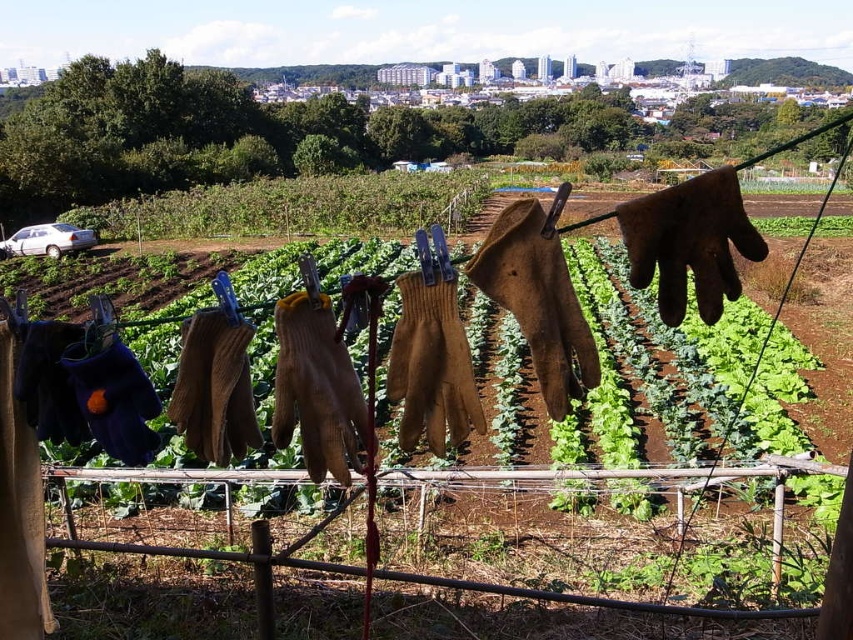
Does brown wooden fence at center have a larger size compared to green leafy at center?

Yes, brown wooden fence at center is bigger than green leafy at center.

Who is more forward, (221, 554) or (801, 230)?

Point (221, 554) is more forward.

Describe the element at coordinates (424, 579) in the screenshot. I see `brown wooden fence at center` at that location.

Locate an element on the screen. This screenshot has height=640, width=853. brown wooden fence at center is located at coordinates click(x=424, y=579).